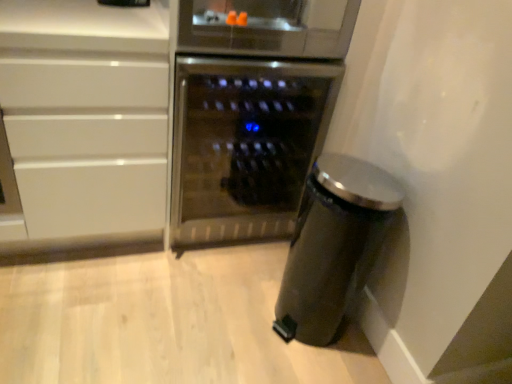
Question: From a real-world perspective, relative to white glossy cabinet at left, is satin black trash can at lower right vertically above or below?

Choices:
 (A) below
 (B) above

Answer: (A)

Question: Is point (301, 329) positioned closer to the camera than point (153, 1)?

Choices:
 (A) closer
 (B) farther

Answer: (B)

Question: Which of these objects is positioned closest to the satin black trash can at lower right?

Choices:
 (A) stainless steel wine cooler at center
 (B) white glossy cabinet at left

Answer: (A)

Question: Based on their relative distances, which object is farther from the stainless steel wine cooler at center?

Choices:
 (A) white glossy cabinet at left
 (B) satin black trash can at lower right

Answer: (B)